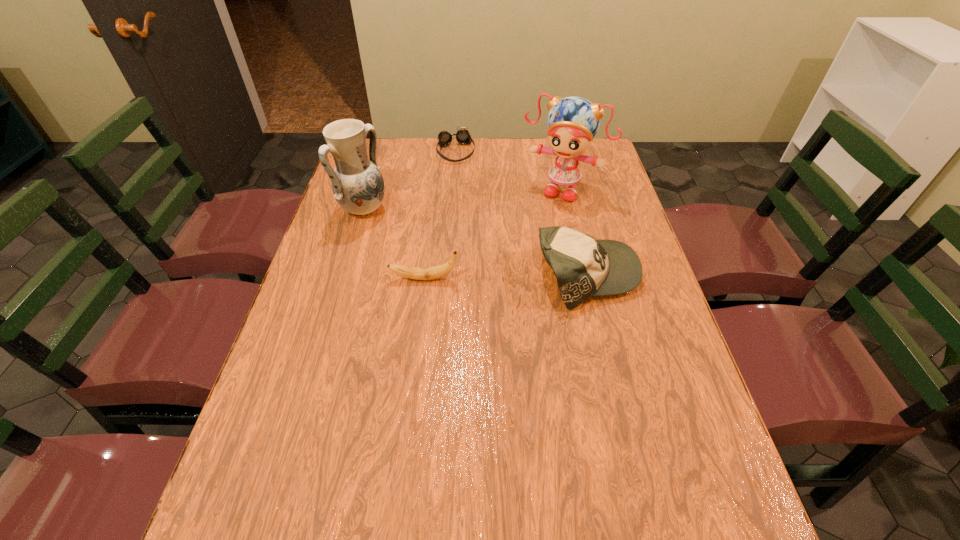
The width and height of the screenshot is (960, 540). Identify the location of the second shortest object. 418,273.

Find the location of a particular element. baseball cap is located at coordinates (584, 267).

Where is `goggles`? This screenshot has height=540, width=960. goggles is located at coordinates (463, 136).

This screenshot has height=540, width=960. Find the location of `the farthest object`. the farthest object is located at coordinates (463, 136).

Identify the location of doll. The height and width of the screenshot is (540, 960). (572, 122).

This screenshot has height=540, width=960. What are the coordinates of `pottery` in the screenshot? It's located at (357, 184).

You are a GUI agent. You are given a task and a screenshot of the screen. Output one action in this format:
    pyautogui.click(x=<x>, y=<y>)
    Task: Click on the free space located 0.110m on the peel of the second shortest object from the top
    The image size is (960, 540).
    Given the screenshot: What is the action you would take?
    pyautogui.click(x=348, y=279)

This screenshot has width=960, height=540. Find the location of `blank area located 0.180m on the peel of the second shortest object from the top`. blank area located 0.180m on the peel of the second shortest object from the top is located at coordinates (322, 279).

This screenshot has height=540, width=960. In order to click on vacant space situated 0.370m through the lenses of the goggles in this screenshot , I will do `click(477, 231)`.

Find the location of a particular element. This screenshot has width=960, height=540. blank space located 0.210m through the lenses of the goggles is located at coordinates (468, 199).